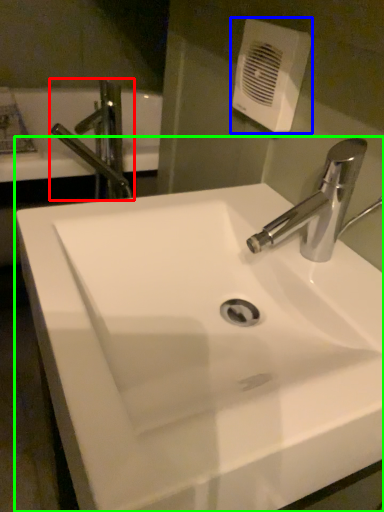
Question: Which is nearer to the tap (highlighted by a red box)? hand dryer (highlighted by a blue box) or sink (highlighted by a green box).

Choices:
 (A) hand dryer
 (B) sink

Answer: (A)